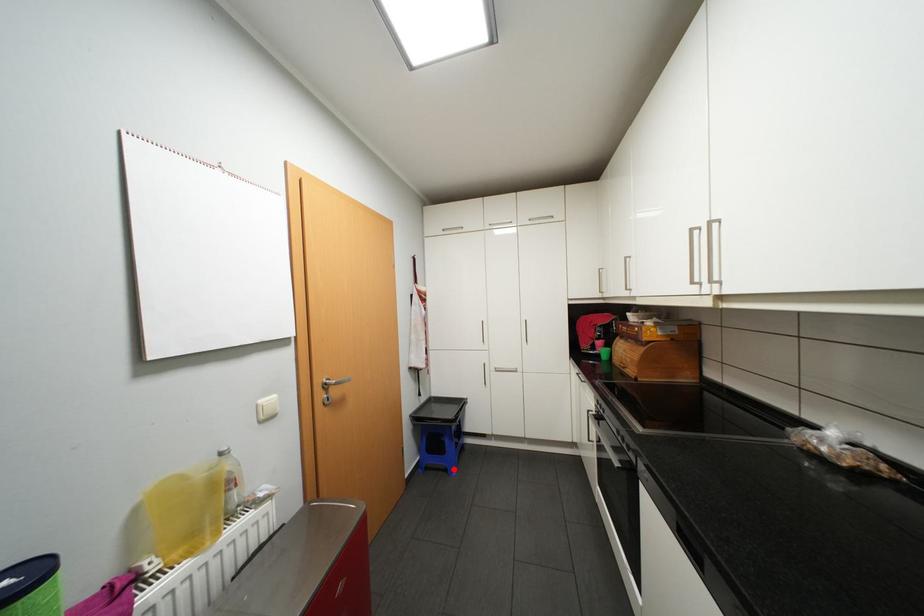
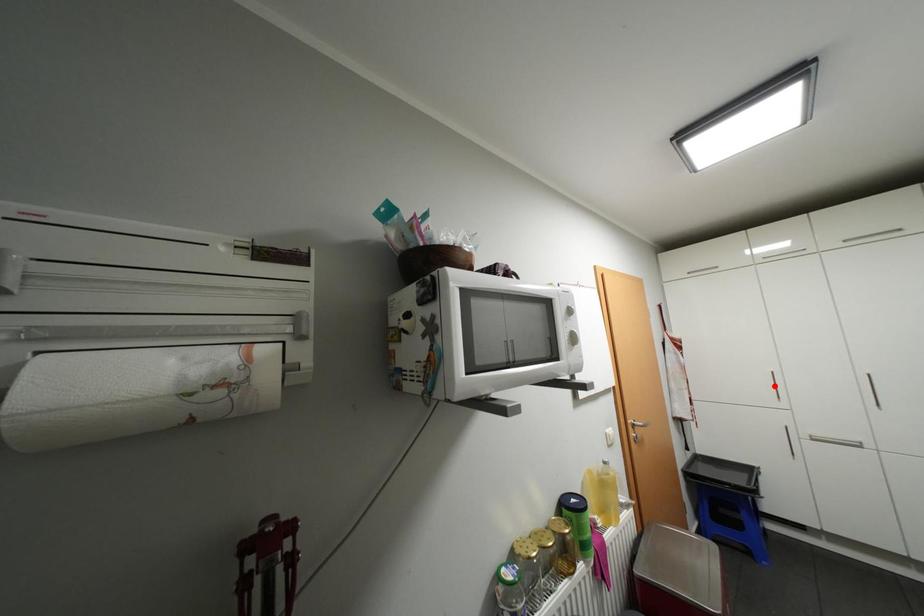
I am providing you with two images of the same scene from different viewpoints. A red point is marked on the first image and another point is marked on the second image. Does the point marked in image1 correspond to the same location as the one in image2?

No